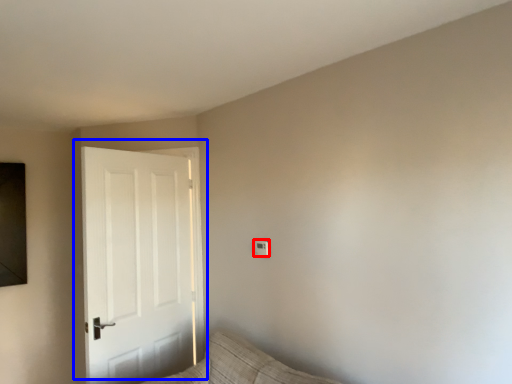
Question: Which object appears farthest to the camera in this image, light switch (highlighted by a red box) or door (highlighted by a blue box)?

Choices:
 (A) light switch
 (B) door

Answer: (A)